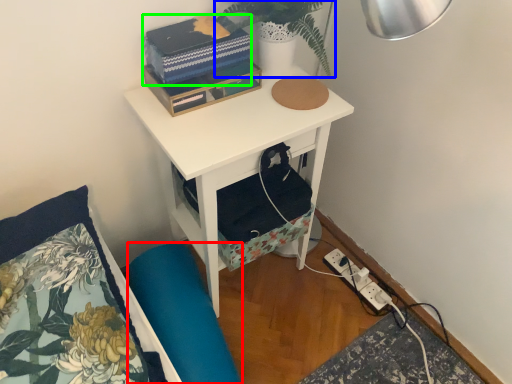
Question: Which is nearer to the swivel chair (highlighted by a red box)? plant (highlighted by a blue box) or book (highlighted by a green box).

Choices:
 (A) plant
 (B) book

Answer: (B)